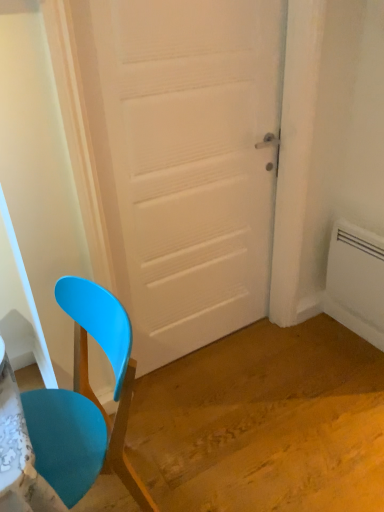
Question: Is white matte door at center surrounding white plastic radiator at right?

Choices:
 (A) no
 (B) yes

Answer: (A)

Question: Can we say white matte door at center lies outside white plastic radiator at right?

Choices:
 (A) yes
 (B) no

Answer: (A)

Question: From the image's perspective, would you say white matte door at center is positioned over white plastic radiator at right?

Choices:
 (A) yes
 (B) no

Answer: (A)

Question: Does white matte door at center have a lesser width compared to white plastic radiator at right?

Choices:
 (A) yes
 (B) no

Answer: (B)

Question: Are white matte door at center and white plastic radiator at right making contact?

Choices:
 (A) yes
 (B) no

Answer: (B)

Question: Is white matte door at center to the right of white plastic radiator at right from the viewer's perspective?

Choices:
 (A) yes
 (B) no

Answer: (B)

Question: Could you tell me if white matte door at center is facing matte plastic chair at left?

Choices:
 (A) no
 (B) yes

Answer: (A)

Question: Is white matte door at center outside of matte plastic chair at left?

Choices:
 (A) yes
 (B) no

Answer: (A)

Question: Is white matte door at center at the right side of matte plastic chair at left?

Choices:
 (A) yes
 (B) no

Answer: (A)

Question: Considering the relative sizes of white matte door at center and matte plastic chair at left in the image provided, is white matte door at center thinner than matte plastic chair at left?

Choices:
 (A) no
 (B) yes

Answer: (B)

Question: Is matte plastic chair at left completely or partially inside white matte door at center?

Choices:
 (A) yes
 (B) no

Answer: (B)

Question: From a real-world perspective, is white matte door at center located higher than matte plastic chair at left?

Choices:
 (A) no
 (B) yes

Answer: (B)

Question: Is matte plastic chair at left shorter than white matte door at center?

Choices:
 (A) no
 (B) yes

Answer: (B)